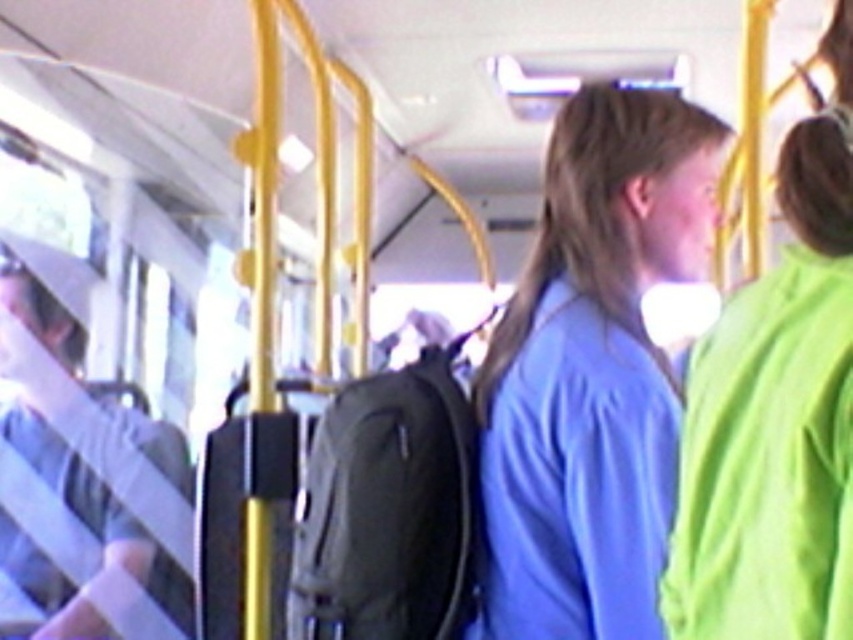
Does point (633, 541) come behind point (738, 611)?

That is True.

Does blue matte shirt at center have a greater width compared to blue fabric shirt at center?

Indeed, blue matte shirt at center has a greater width compared to blue fabric shirt at center.

Is point (648, 362) farther from camera compared to point (819, 344)?

That is True.

Identify the location of blue matte shirt at center. (592, 372).

The image size is (853, 640). Find the location of `blue fabric shirt at center`. blue fabric shirt at center is located at coordinates (776, 412).

Which of these two, blue fabric shirt at center or light gray fabric bag at left, stands taller?

Standing taller between the two is light gray fabric bag at left.

What do you see at coordinates (776, 412) in the screenshot? Image resolution: width=853 pixels, height=640 pixels. I see `blue fabric shirt at center` at bounding box center [776, 412].

This screenshot has height=640, width=853. Identify the location of blue fabric shirt at center. (776, 412).

Is blue matte shirt at center to the right of light gray fabric bag at left from the viewer's perspective?

Correct, you'll find blue matte shirt at center to the right of light gray fabric bag at left.

Which of these two, blue matte shirt at center or light gray fabric bag at left, stands taller?

light gray fabric bag at left is taller.

Find the location of a particular element. blue matte shirt at center is located at coordinates (592, 372).